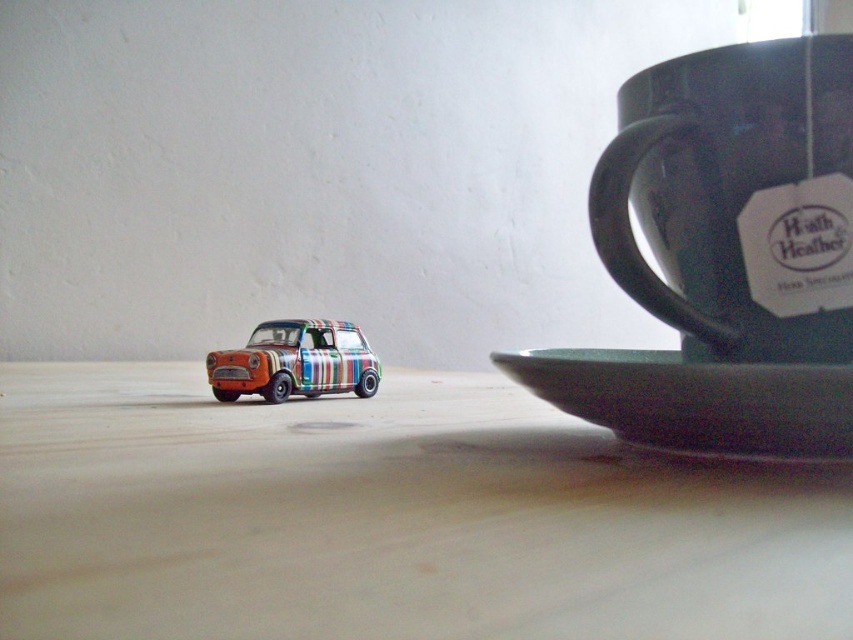
Can you confirm if wooden table at center is bigger than matte dark green mug at upper right?

Yes.

Is point (30, 616) closer to viewer compared to point (717, 64)?

Yes, point (30, 616) is in front of point (717, 64).

Which is behind, point (39, 561) or point (793, 144)?

The point (793, 144) is behind.

You are a GUI agent. You are given a task and a screenshot of the screen. Output one action in this format:
    pyautogui.click(x=<x>, y=<y>)
    Task: Click on the wooden table at center
    The image size is (853, 640).
    Given the screenshot: What is the action you would take?
    pyautogui.click(x=389, y=518)

Is matte dark green mug at upper right bigger than green matte saucer at lower right?

Yes, matte dark green mug at upper right is bigger than green matte saucer at lower right.

Is point (595, 196) positioned after point (589, 355)?

No, (595, 196) is in front of (589, 355).

What are the coordinates of `matte dark green mug at upper right` in the screenshot? It's located at (723, 188).

Does green matte saucer at lower right have a greater width compared to multicolored striped car at lower left?

Yes, green matte saucer at lower right is wider than multicolored striped car at lower left.

Identify the location of green matte saucer at lower right. The width and height of the screenshot is (853, 640). (695, 401).

Is point (602, 397) behind point (283, 356)?

No, it is not.

At what (x,y) coordinates should I click in order to perform the action: click on green matte saucer at lower right. Please return your answer as a coordinate pair (x, y). Looking at the image, I should click on (695, 401).